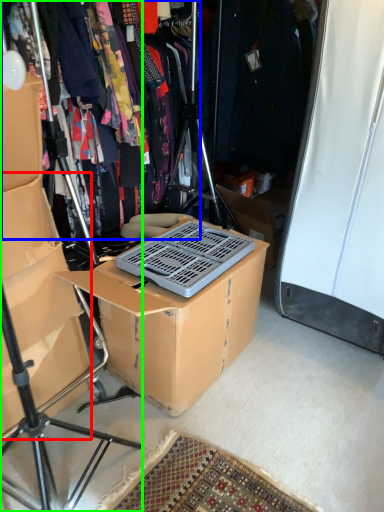
Question: Estimate the real-world distances between objects in this image. Which object is closer to storage box (highlighted by a red box), clothing (highlighted by a blue box) or tripod (highlighted by a green box)?

Choices:
 (A) clothing
 (B) tripod

Answer: (B)